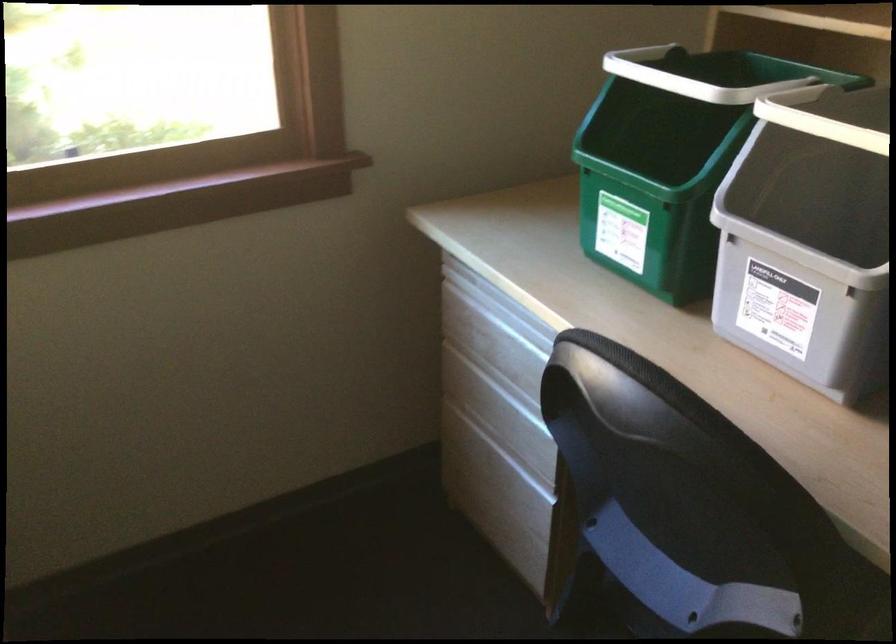
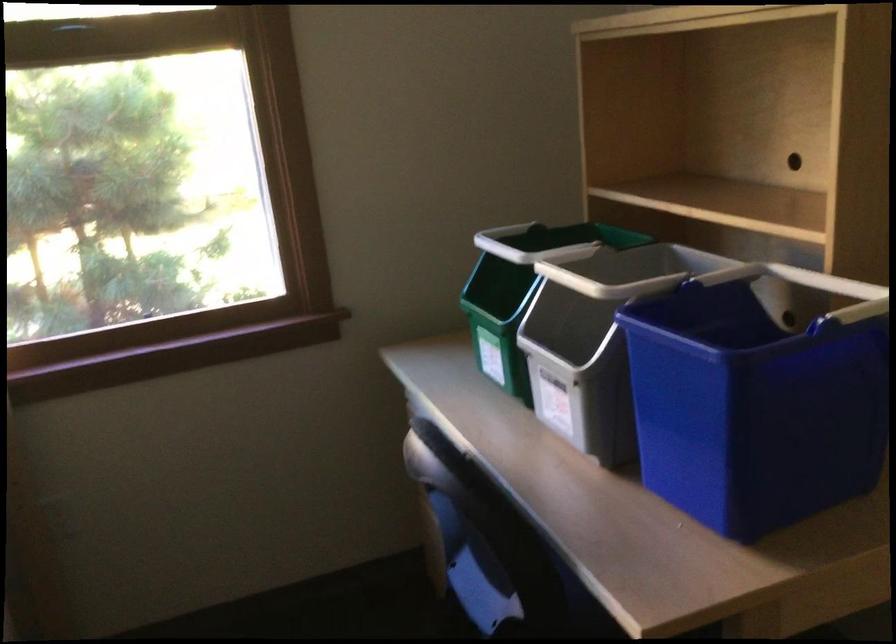
The images are taken continuously from a first-person perspective. In which direction are you moving?

The cameraman moved toward right, backward.